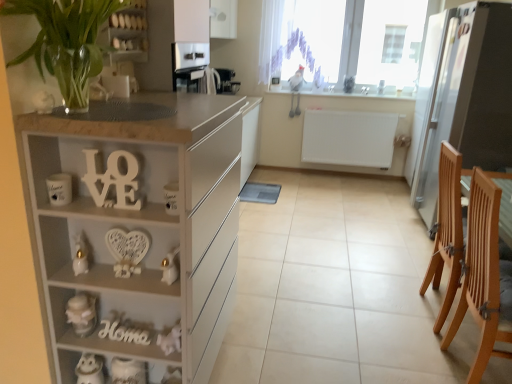
Question: Is white matte cabinet at left in front of or behind white ceramic owl at lower left, the first appliance viewed from the left, in the image?

Choices:
 (A) front
 (B) behind

Answer: (A)

Question: From a real-world perspective, is white matte cabinet at left physically located above or below white ceramic owl at lower left, marked as the 3th appliance in a back-to-front arrangement?

Choices:
 (A) above
 (B) below

Answer: (A)

Question: Which is farther from the white glossy cabinet at upper center?

Choices:
 (A) white ceramic mug at left, which appears as the 2th appliance when viewed from the left
 (B) wooden sign at lower center, the second alphabet when ordered from top to bottom
 (C) white glossy candle at lower left, the first toy from the right
 (D) transparent glass window at upper center
 (E) clear glass vase at upper left

Answer: (D)

Question: Which is farther from the satin black coffee machine at upper center, the 4th appliance in the front-to-back sequence?

Choices:
 (A) white ceramic owl at lower left, marked as the 3th appliance in a back-to-front arrangement
 (B) white wood love sign at center, which appears as the 2th alphabet when viewed from the back
 (C) white sheer curtain at upper center
 (D) white ceramic mug at left, the 3th appliance viewed from the right
 (E) white matte jar at lower left, placed as the first toy when sorted from left to right

Answer: (C)